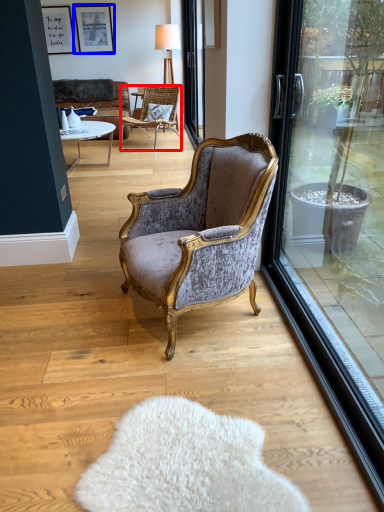
Question: Among these objects, which one is nearest to the camera, chair (highlighted by a red box) or picture frame (highlighted by a blue box)?

Choices:
 (A) chair
 (B) picture frame

Answer: (A)